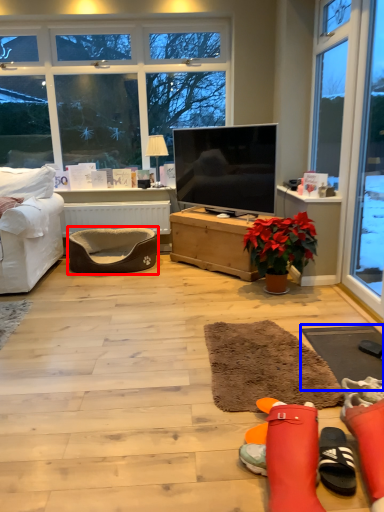
Question: Which of the following is the closest to the observer, footrest (highlighted by a red box) or flat (highlighted by a blue box)?

Choices:
 (A) footrest
 (B) flat

Answer: (B)